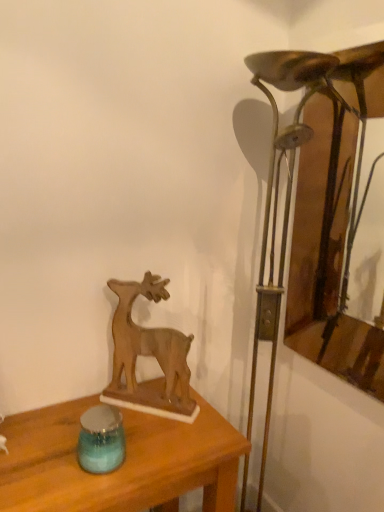
Question: Is wooden table at center facing towards bronze metallic table lamp at right?

Choices:
 (A) no
 (B) yes

Answer: (A)

Question: Can you confirm if wooden table at center is smaller than bronze metallic table lamp at right?

Choices:
 (A) yes
 (B) no

Answer: (A)

Question: Considering the relative positions of wooden table at center and bronze metallic table lamp at right in the image provided, is wooden table at center behind bronze metallic table lamp at right?

Choices:
 (A) yes
 (B) no

Answer: (B)

Question: Is wooden table at center at the right side of bronze metallic table lamp at right?

Choices:
 (A) no
 (B) yes

Answer: (A)

Question: Does wooden table at center have a greater height compared to bronze metallic table lamp at right?

Choices:
 (A) no
 (B) yes

Answer: (A)

Question: In terms of height, does wooden frame at right look taller or shorter compared to wooden table at center?

Choices:
 (A) short
 (B) tall

Answer: (B)

Question: Based on their sizes in the image, would you say wooden frame at right is bigger or smaller than wooden table at center?

Choices:
 (A) big
 (B) small

Answer: (B)

Question: From a real-world perspective, is wooden frame at right physically located above or below wooden table at center?

Choices:
 (A) below
 (B) above

Answer: (B)

Question: In the image, is wooden frame at right on the left side or the right side of wooden table at center?

Choices:
 (A) right
 (B) left

Answer: (A)

Question: Considering the positions of wooden table at center and bronze metallic table lamp at right in the image, is wooden table at center bigger or smaller than bronze metallic table lamp at right?

Choices:
 (A) big
 (B) small

Answer: (B)

Question: Is wooden table at center spatially inside bronze metallic table lamp at right, or outside of it?

Choices:
 (A) inside
 (B) outside

Answer: (B)

Question: From a real-world perspective, is wooden table at center positioned above or below bronze metallic table lamp at right?

Choices:
 (A) above
 (B) below

Answer: (B)

Question: Is wooden table at center taller or shorter than bronze metallic table lamp at right?

Choices:
 (A) short
 (B) tall

Answer: (A)

Question: In terms of width, does wooden deer at center look wider or thinner when compared to blue glass candle holder at lower left?

Choices:
 (A) thin
 (B) wide

Answer: (A)

Question: In the image, is wooden deer at center on the left side or the right side of blue glass candle holder at lower left?

Choices:
 (A) left
 (B) right

Answer: (B)